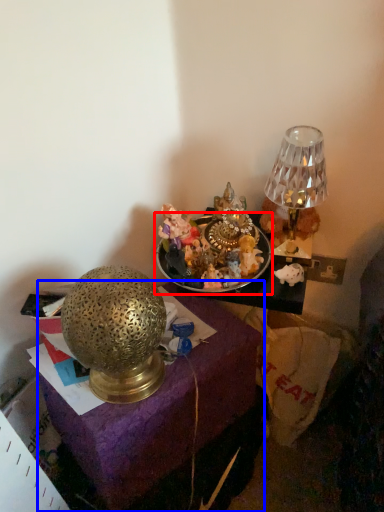
Question: Among these objects, which one is nearest to the camera, tableware (highlighted by a red box) or furniture (highlighted by a blue box)?

Choices:
 (A) tableware
 (B) furniture

Answer: (B)